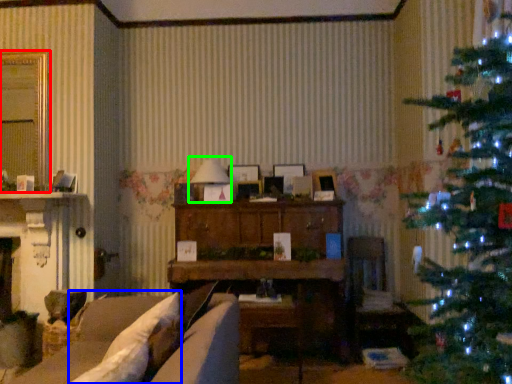
Question: Which is nearer to the window (highlighted by a red box)? pillow (highlighted by a blue box) or lamp (highlighted by a green box).

Choices:
 (A) pillow
 (B) lamp

Answer: (B)